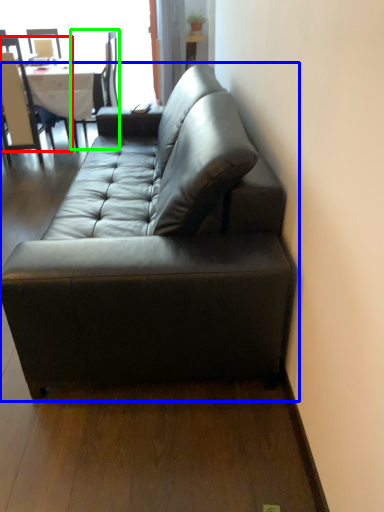
Question: Which object is positioned farthest from chair (highlighted by a red box)? Select from studio couch (highlighted by a blue box) and chair (highlighted by a green box).

Choices:
 (A) studio couch
 (B) chair

Answer: (A)